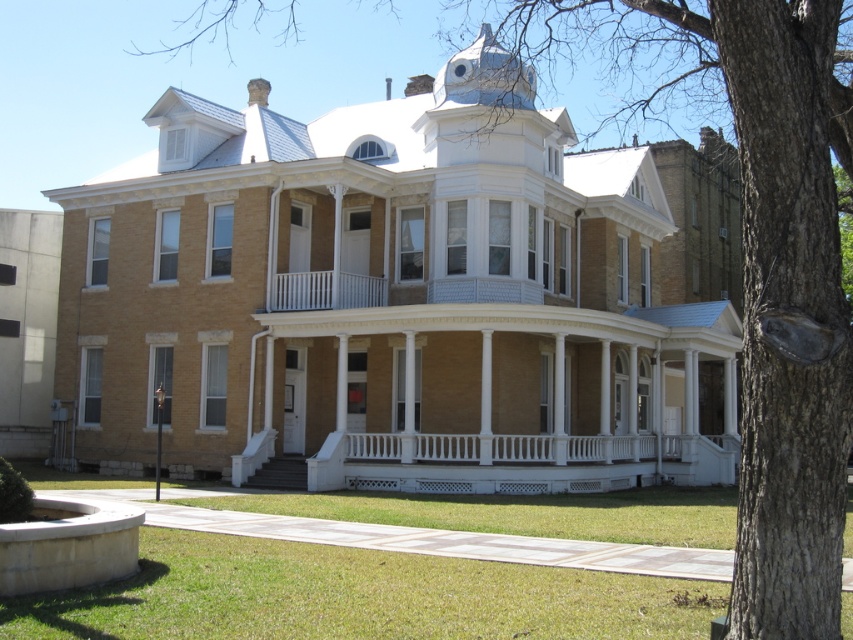
Question: Is green grass at lower center further to camera compared to white painted wood porch at center?

Choices:
 (A) yes
 (B) no

Answer: (B)

Question: Among these objects, which one is farthest from the camera?

Choices:
 (A) white painted wood porch at center
 (B) green grass at lower center

Answer: (A)

Question: Is green grass at lower center wider than white painted wood porch at center?

Choices:
 (A) no
 (B) yes

Answer: (A)

Question: Is green grass at lower center to the right of white painted wood porch at center from the viewer's perspective?

Choices:
 (A) yes
 (B) no

Answer: (B)

Question: Which of the following is the farthest from the observer?

Choices:
 (A) green grass at lower center
 (B) white painted wood porch at center

Answer: (B)